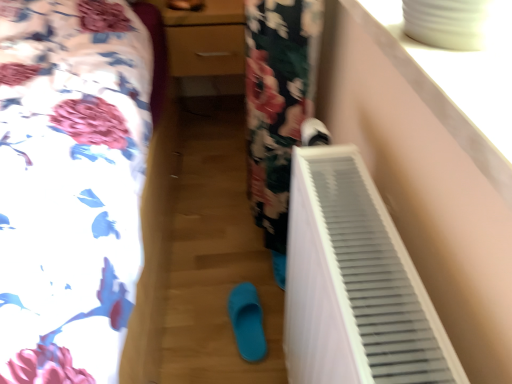
Question: Does white matte shoe at upper right, the second footwear in the back-to-front sequence, appear on the right side of matte wood dresser at center?

Choices:
 (A) no
 (B) yes

Answer: (B)

Question: Is white matte shoe at upper right, marked as the 2th footwear in a bottom-to-top arrangement, bigger than matte wood dresser at center?

Choices:
 (A) no
 (B) yes

Answer: (A)

Question: From a real-world perspective, is white matte shoe at upper right, which is the 1th footwear in top-to-bottom order, physically above matte wood dresser at center?

Choices:
 (A) no
 (B) yes

Answer: (B)

Question: Are white matte shoe at upper right, the second footwear in the back-to-front sequence, and matte wood dresser at center located far from each other?

Choices:
 (A) yes
 (B) no

Answer: (B)

Question: From a real-world perspective, is white matte shoe at upper right, which is the 1th footwear in top-to-bottom order, positioned under matte wood dresser at center based on gravity?

Choices:
 (A) no
 (B) yes

Answer: (A)

Question: Is white matte shoe at upper right, acting as the 1th footwear starting from the front, at the left side of matte wood dresser at center?

Choices:
 (A) no
 (B) yes

Answer: (A)

Question: Is the position of white plastic radiator at lower right less distant than that of white matte shoe at upper right, marked as the 2th footwear in a bottom-to-top arrangement?

Choices:
 (A) yes
 (B) no

Answer: (A)

Question: Is white plastic radiator at lower right far away from white matte shoe at upper right, marked as the 2th footwear in a bottom-to-top arrangement?

Choices:
 (A) yes
 (B) no

Answer: (B)

Question: Can you confirm if white plastic radiator at lower right is bigger than white matte shoe at upper right, acting as the 1th footwear starting from the right?

Choices:
 (A) no
 (B) yes

Answer: (B)

Question: Does white plastic radiator at lower right have a lesser height compared to white matte shoe at upper right, which is the 1th footwear in top-to-bottom order?

Choices:
 (A) no
 (B) yes

Answer: (A)

Question: Would you say white matte shoe at upper right, marked as the 2th footwear in a bottom-to-top arrangement, is part of white plastic radiator at lower right's contents?

Choices:
 (A) no
 (B) yes

Answer: (A)

Question: Is the position of white plastic radiator at lower right more distant than that of white matte shoe at upper right, marked as the 2th footwear in a bottom-to-top arrangement?

Choices:
 (A) yes
 (B) no

Answer: (B)

Question: Can you confirm if matte wood dresser at center is shorter than white matte shoe at upper right, acting as the 1th footwear starting from the right?

Choices:
 (A) yes
 (B) no

Answer: (B)